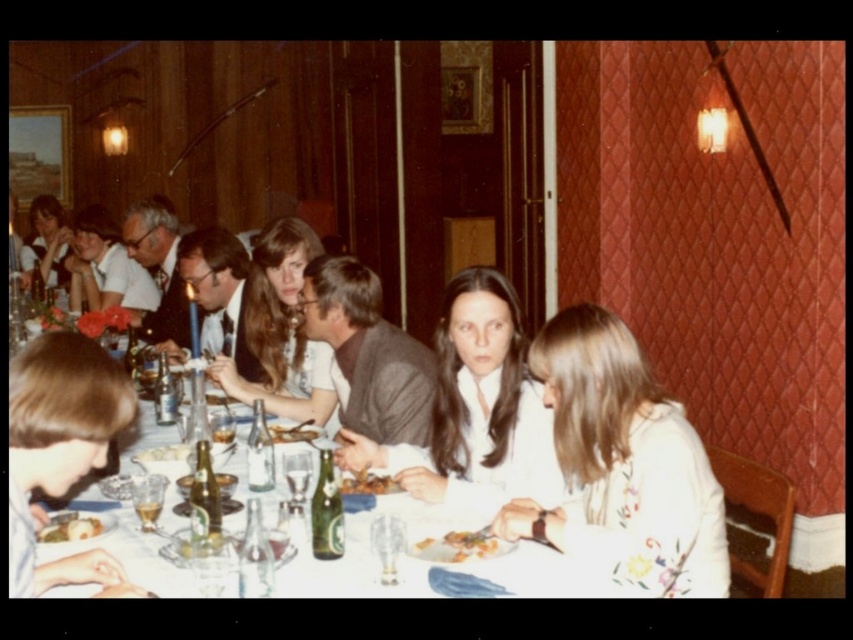
You are a waiter at a formal dinner. You need to place a small vase between the golden crispy bread at center and the golden brown bread at center. Since the vase is only 3 inches tall, will it be stable on the table between them?

The golden crispy bread at center has a lesser height compared to golden brown bread at center. Since the vase is only 3 inches tall, it will be stable as the height difference between the two breads is not mentioned to be significant enough to affect stability.

You are a waiter in a restaurant and need to place a new dish on the table. The dish requires a spot that is not occupied by the golden crispy bread at center. Where should you place it?

Since the golden crispy bread at center is located at point (457, 547), you should place the new dish in an area of the table that does not overlap with this coordinate to avoid occupying its space.